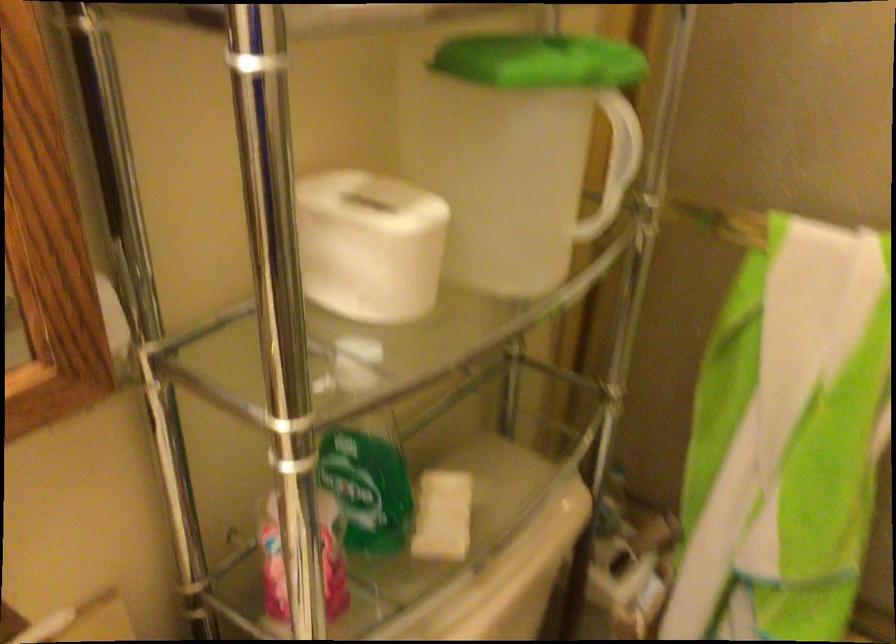
The height and width of the screenshot is (644, 896). I want to click on green pitcher lid, so pyautogui.click(x=539, y=61).